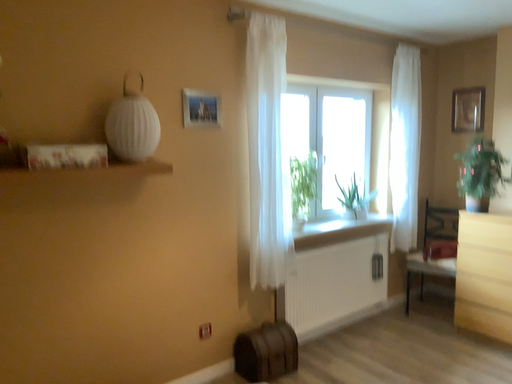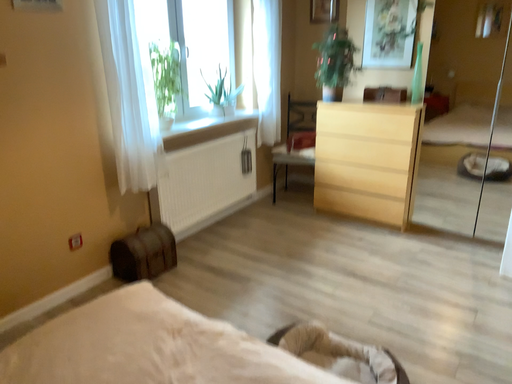
Question: How did the camera likely rotate when shooting the video?

Choices:
 (A) rotated downward
 (B) rotated upward

Answer: (A)